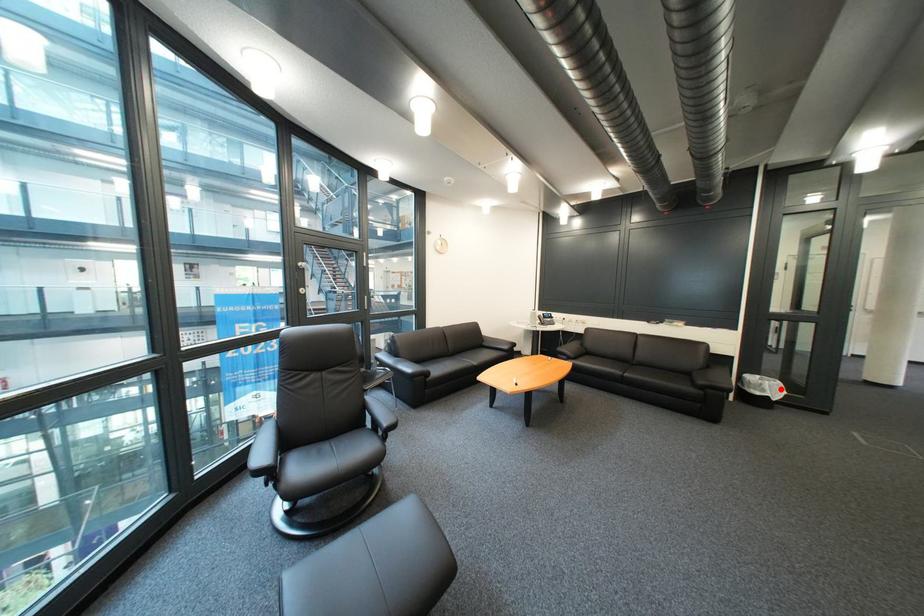
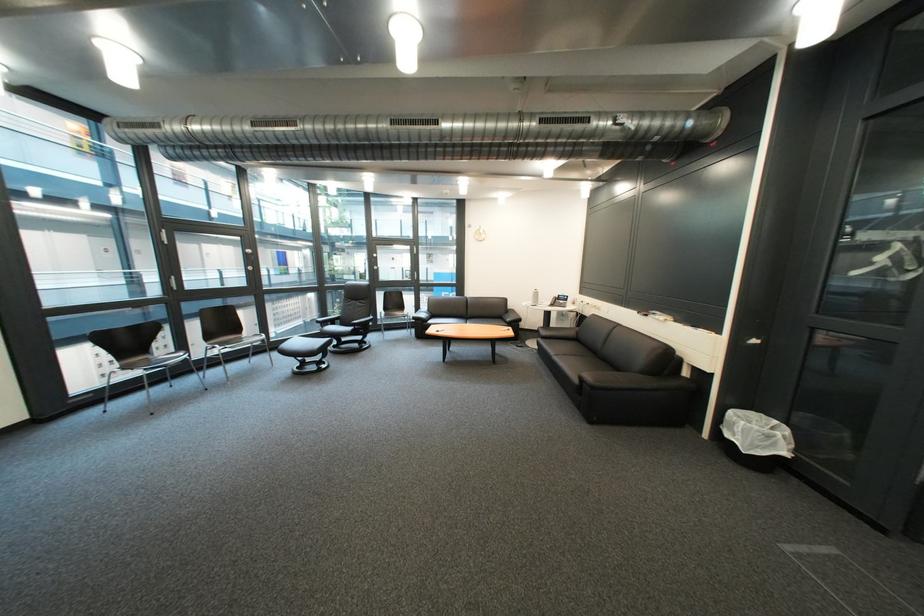
Find the pixel in the second image that matches the highlighted location in the first image.

(751, 431)